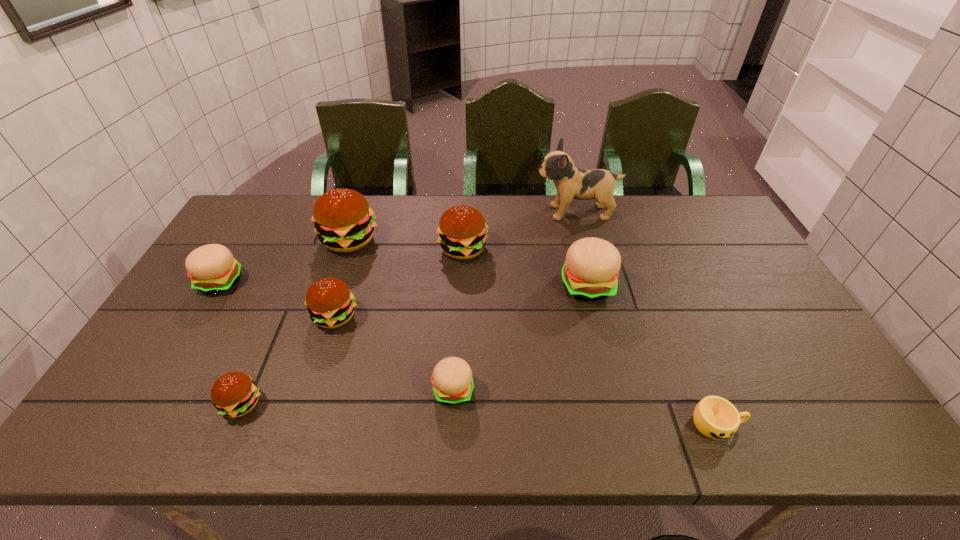
This screenshot has height=540, width=960. In order to click on free space located on the right of the third farthest brown hamburger in this screenshot , I will do coord(395,316).

Locate an element on the screen. vacant region located on the back of the leftmost object is located at coordinates (269, 202).

Locate an element on the screen. Image resolution: width=960 pixels, height=540 pixels. blank area located on the left of the nearest brown hamburger is located at coordinates (181, 404).

This screenshot has width=960, height=540. In order to click on vacant space located on the left of the second beige hamburger from left to right in this screenshot , I will do `click(324, 390)`.

I want to click on free space located 0.210m on the left of the cup, so click(x=598, y=424).

Identify the location of puppy that is at the far edge. This screenshot has width=960, height=540. 571,183.

Identify the location of cup that is at the near edge. (715, 417).

This screenshot has width=960, height=540. Find the location of `object positioned at the left edge`. object positioned at the left edge is located at coordinates (212, 269).

You are a GUI agent. You are given a task and a screenshot of the screen. Output one action in this format:
    pyautogui.click(x=<x>, y=<y>)
    Task: Click on the free space at the far edge of the desktop
    
    Given the screenshot: What is the action you would take?
    pyautogui.click(x=305, y=198)

Where is `vacant area at the near edge`? vacant area at the near edge is located at coordinates (635, 419).